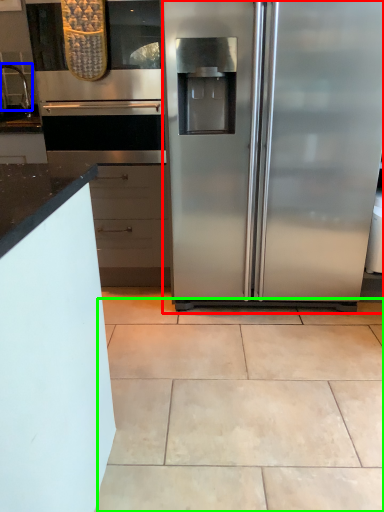
Question: Which object is positioned farthest from refrigerator (highlighted by a red box)? Select from faucet (highlighted by a blue box) and ceramic tile (highlighted by a green box).

Choices:
 (A) faucet
 (B) ceramic tile

Answer: (A)